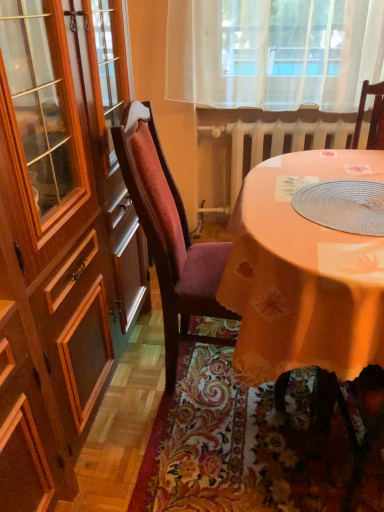
Locate an element on the screen. Image resolution: width=384 pixels, height=512 pixels. unoccupied area in front of velvet burgundy chair at center is located at coordinates (162, 451).